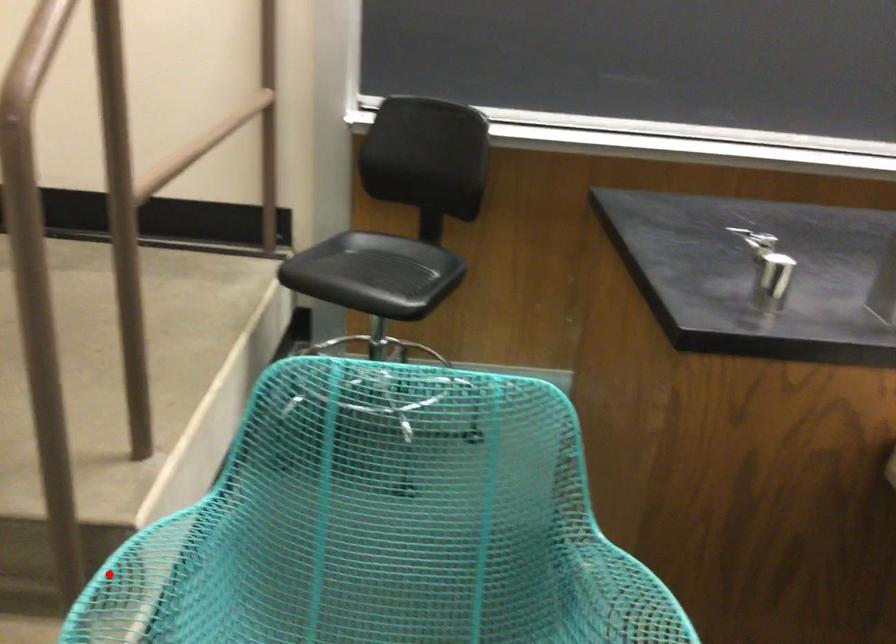
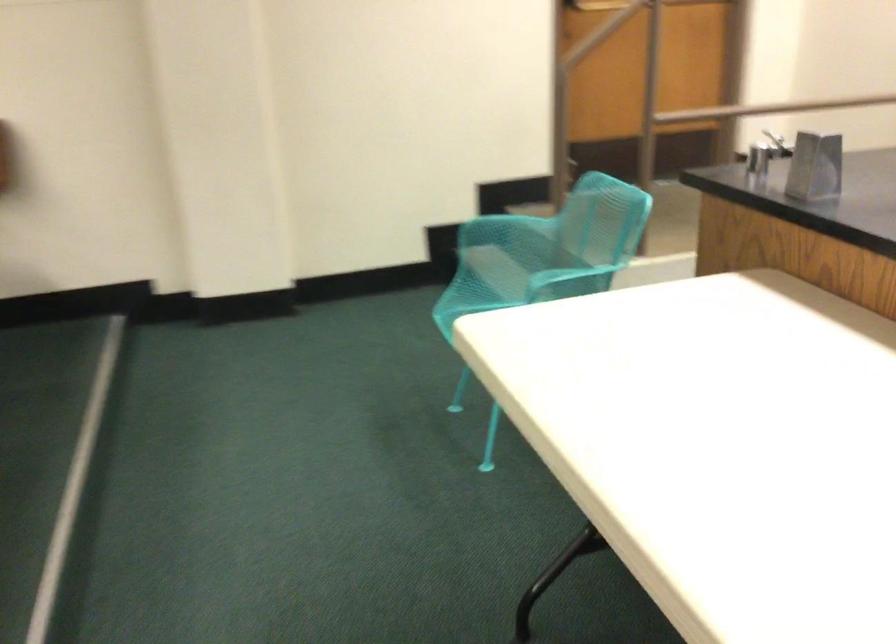
In the second image, find the point that corresponds to the highlighted location in the first image.

(494, 218)